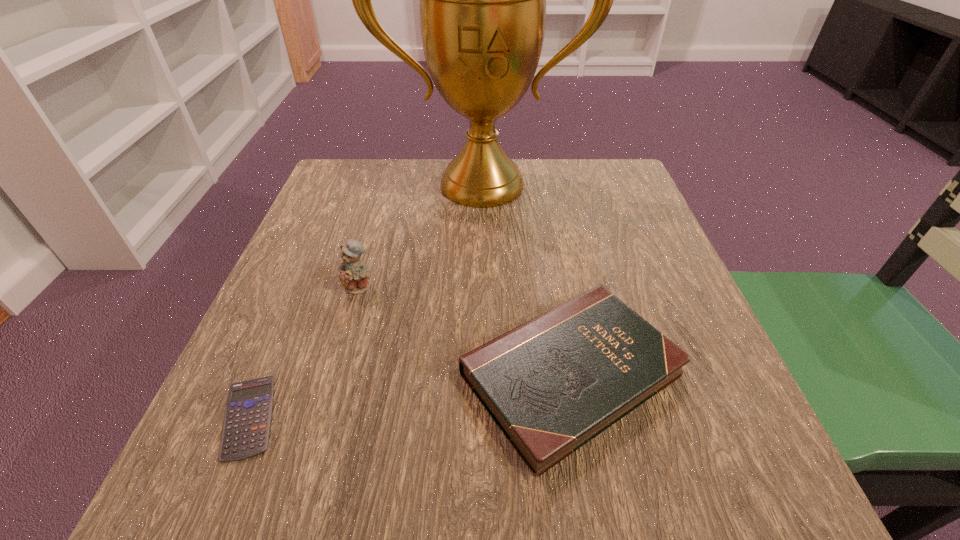
Identify the location of vacant region that satisfies the following two spatial constraints: 1. on the surface of the Bible with symbols; 2. on the left side of the tallest object. (483, 374).

The image size is (960, 540). Find the location of `vacant space that satisfies the following two spatial constraints: 1. on the surface of the farthest object with symbols; 2. on the right side of the second shortest object`. vacant space that satisfies the following two spatial constraints: 1. on the surface of the farthest object with symbols; 2. on the right side of the second shortest object is located at coordinates (483, 374).